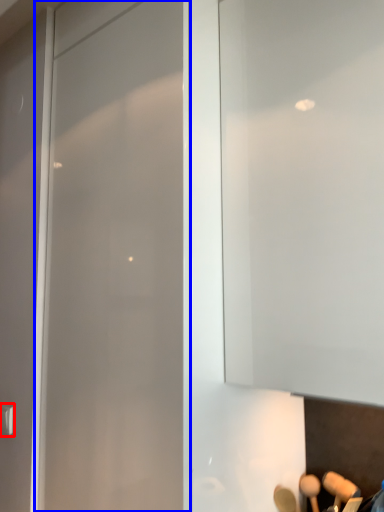
Question: Which object appears farthest to the camera in this image, door handle (highlighted by a red box) or glass door (highlighted by a blue box)?

Choices:
 (A) door handle
 (B) glass door

Answer: (A)